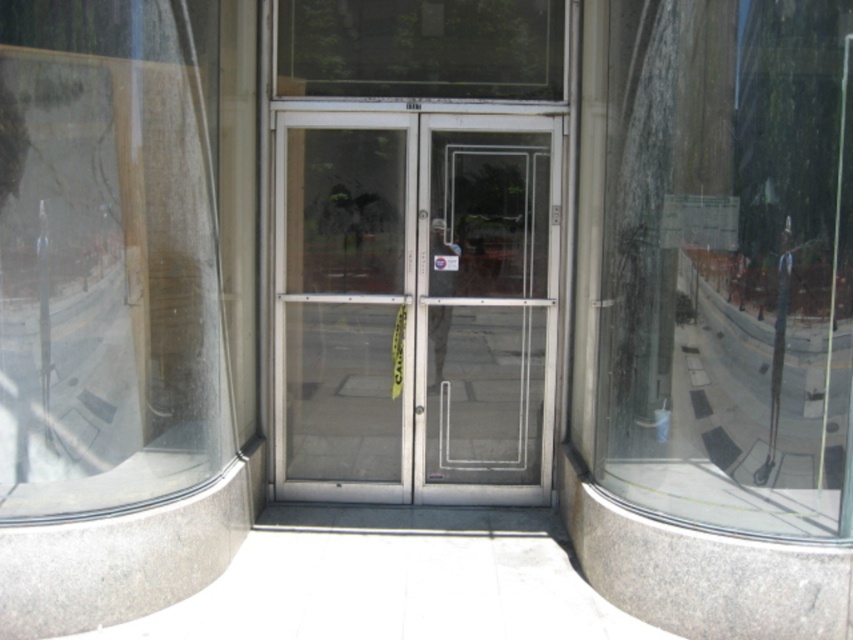
Question: Which object is farther from the camera taking this photo?

Choices:
 (A) transparent glass door at center
 (B) transparent glass window at center
 (C) transparent glass window at left

Answer: (A)

Question: Which is nearer to the clear glass door at center?

Choices:
 (A) transparent glass window at center
 (B) transparent glass window at left

Answer: (B)

Question: Is transparent glass window at left behind clear glass door at center?

Choices:
 (A) no
 (B) yes

Answer: (A)

Question: Which point appears closest to the camera in this image?

Choices:
 (A) (753, 433)
 (B) (279, 150)

Answer: (A)

Question: In this image, where is transparent glass window at center located relative to clear glass door at center?

Choices:
 (A) below
 (B) above

Answer: (B)

Question: Is transparent glass window at left to the right of transparent glass door at center from the viewer's perspective?

Choices:
 (A) yes
 (B) no

Answer: (B)